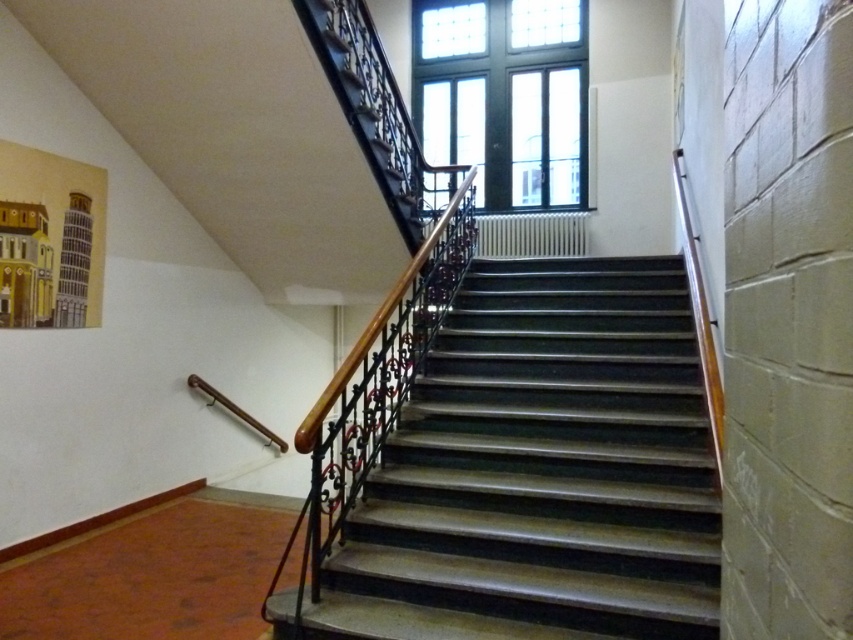
Question: Is shiny dark wood stairs at center below clear glass window at upper center?

Choices:
 (A) yes
 (B) no

Answer: (A)

Question: Which of the following is the closest to the observer?

Choices:
 (A) clear glass window at upper center
 (B) shiny dark wood stairs at center

Answer: (B)

Question: Which object appears closest to the camera in this image?

Choices:
 (A) shiny dark wood stairs at center
 (B) clear glass window at upper center

Answer: (A)

Question: Does shiny dark wood stairs at center appear under clear glass window at upper center?

Choices:
 (A) yes
 (B) no

Answer: (A)

Question: Can you confirm if shiny dark wood stairs at center is positioned above clear glass window at upper center?

Choices:
 (A) yes
 (B) no

Answer: (B)